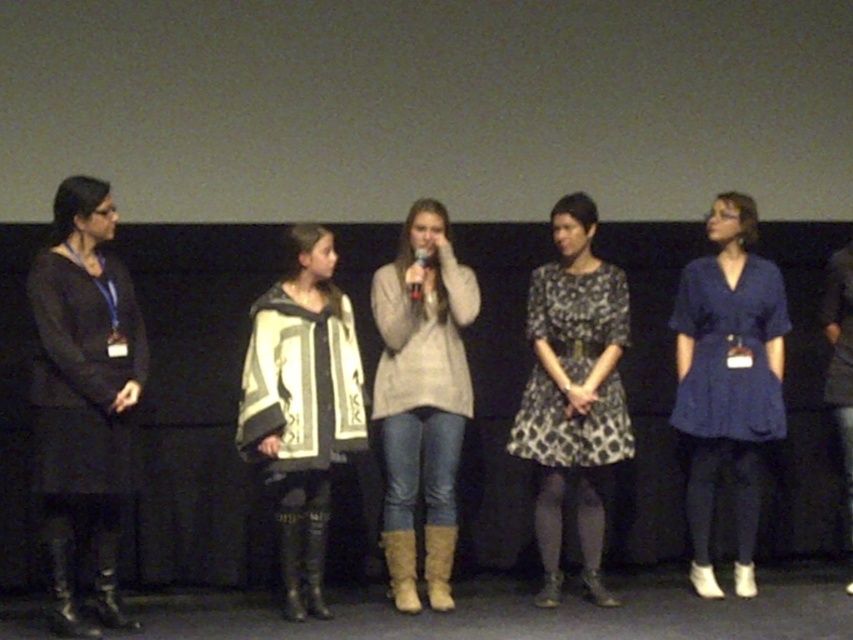
Does matte black dress at left appear under white and black patterned poncho at center?

Incorrect, matte black dress at left is not positioned below white and black patterned poncho at center.

Looking at this image, who is positioned more to the left, matte black dress at left or white and black patterned poncho at center?

From the viewer's perspective, matte black dress at left appears more on the left side.

This screenshot has height=640, width=853. Describe the element at coordinates (84, 396) in the screenshot. I see `matte black dress at left` at that location.

Find the location of `matte black dress at left`. matte black dress at left is located at coordinates (84, 396).

This screenshot has width=853, height=640. What are the coordinates of `matte black dress at left` in the screenshot? It's located at (84, 396).

Identify the location of matte black dress at left. (84, 396).

Identify the location of matte black dress at left. (84, 396).

Can you confirm if matte black dress at left is positioned above light beige sweater at center?

Yes, matte black dress at left is above light beige sweater at center.

Between point (73, 184) and point (444, 372), which one is positioned in front?

Point (73, 184) is in front.

What do you see at coordinates (84, 396) in the screenshot? I see `matte black dress at left` at bounding box center [84, 396].

I want to click on matte black dress at left, so click(84, 396).